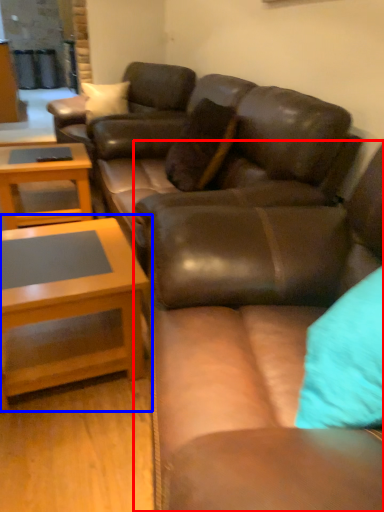
Question: Which object appears closest to the camera in this image, studio couch (highlighted by a red box) or coffee table (highlighted by a blue box)?

Choices:
 (A) studio couch
 (B) coffee table

Answer: (A)